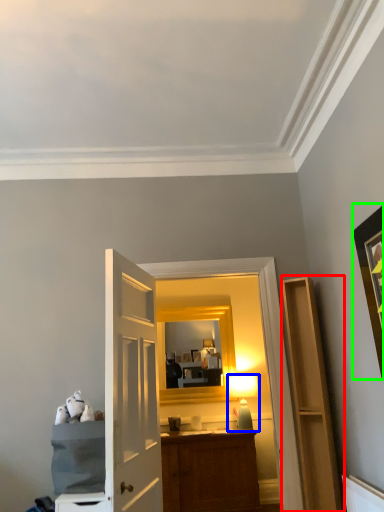
Question: Which object is positioned farthest from cabinetry (highlighted by a red box)? Select from table lamp (highlighted by a blue box) and picture frame (highlighted by a green box).

Choices:
 (A) table lamp
 (B) picture frame

Answer: (A)